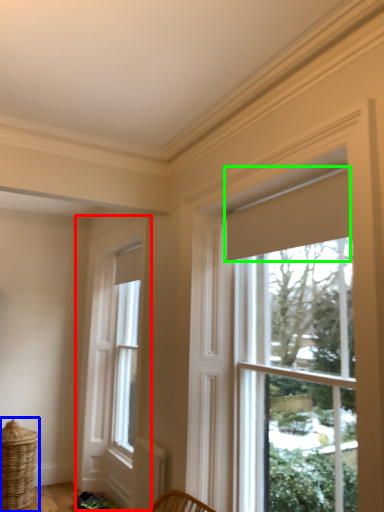
Question: Considering the real-world distances, which object is closest to window (highlighted by a red box)? basket (highlighted by a blue box) or curtain (highlighted by a green box).

Choices:
 (A) basket
 (B) curtain

Answer: (A)